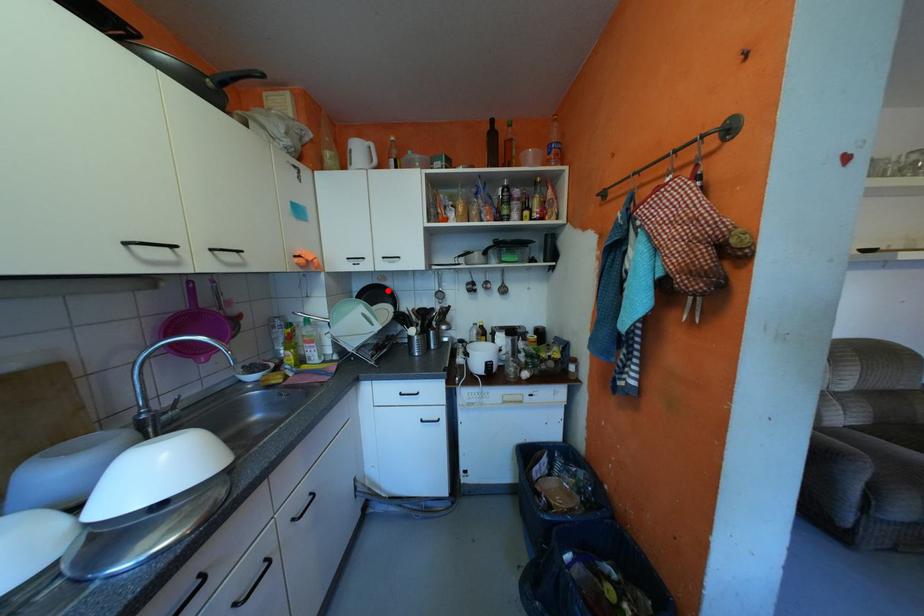
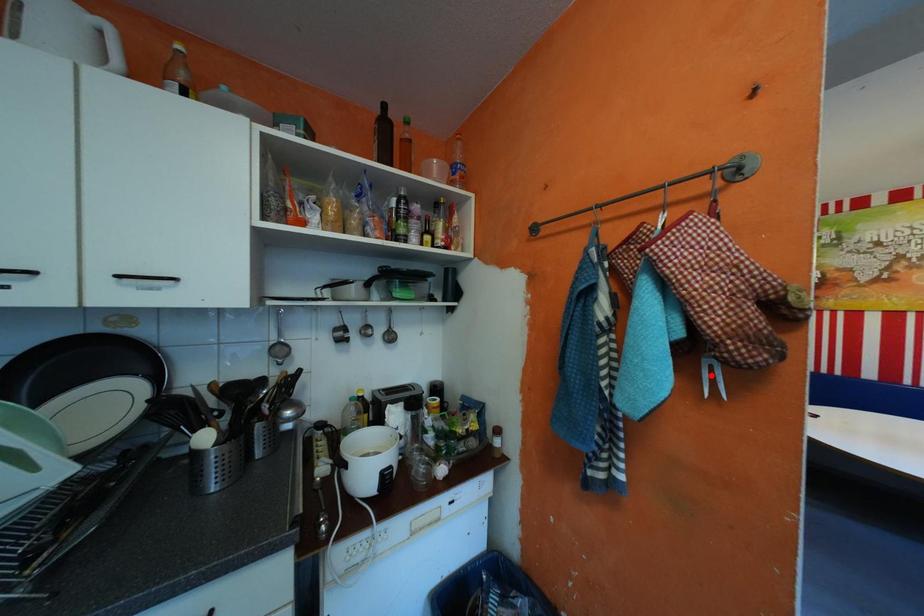
I am providing you with two images of the same scene from different viewpoints. A red point is marked on the first image and another point is marked on the second image. Is the red point in image1 aligned with the point shown in image2?

No